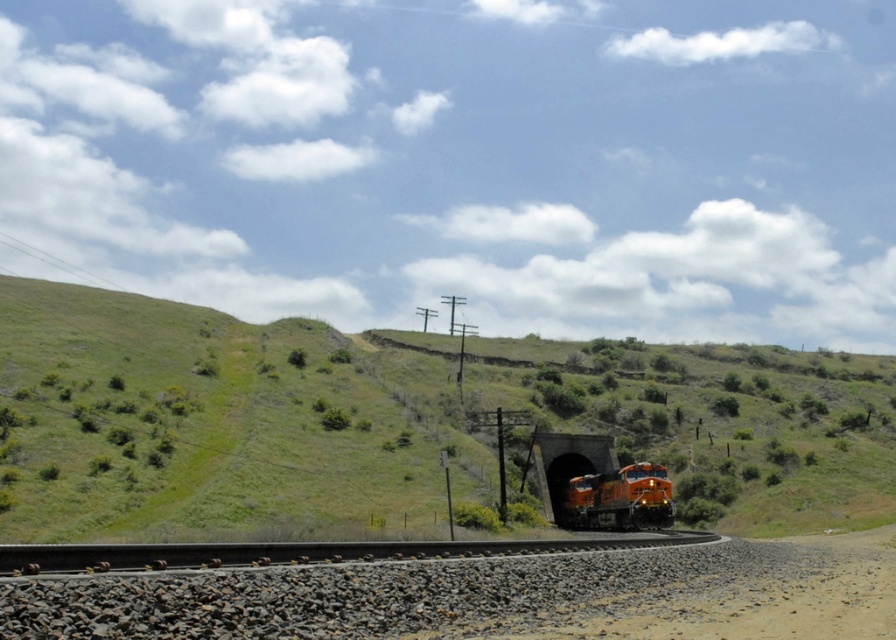
Is orange metallic train at lower center to the right of dark gray concrete tunnel at center from the viewer's perspective?

Correct, you'll find orange metallic train at lower center to the right of dark gray concrete tunnel at center.

The height and width of the screenshot is (640, 896). Identify the location of orange metallic train at lower center. (619, 499).

Which is behind, point (597, 484) or point (548, 436)?

The point (548, 436) is behind.

Locate an element on the screen. This screenshot has height=640, width=896. orange metallic train at lower center is located at coordinates (619, 499).

Who is more distant from viewer, (711, 595) or (627, 545)?

The point (627, 545) is more distant.

Where is `brown gravel dirt track at lower center`? The height and width of the screenshot is (640, 896). brown gravel dirt track at lower center is located at coordinates (487, 595).

Which is below, black asphalt track at center or orange metallic train at lower center?

orange metallic train at lower center is lower down.

Can you confirm if black asphalt track at center is thinner than orange metallic train at lower center?

Incorrect, black asphalt track at center's width is not less than orange metallic train at lower center's.

Is point (237, 556) positioned behind point (635, 499)?

No.

Locate an element on the screen. This screenshot has width=896, height=640. black asphalt track at center is located at coordinates (302, 552).